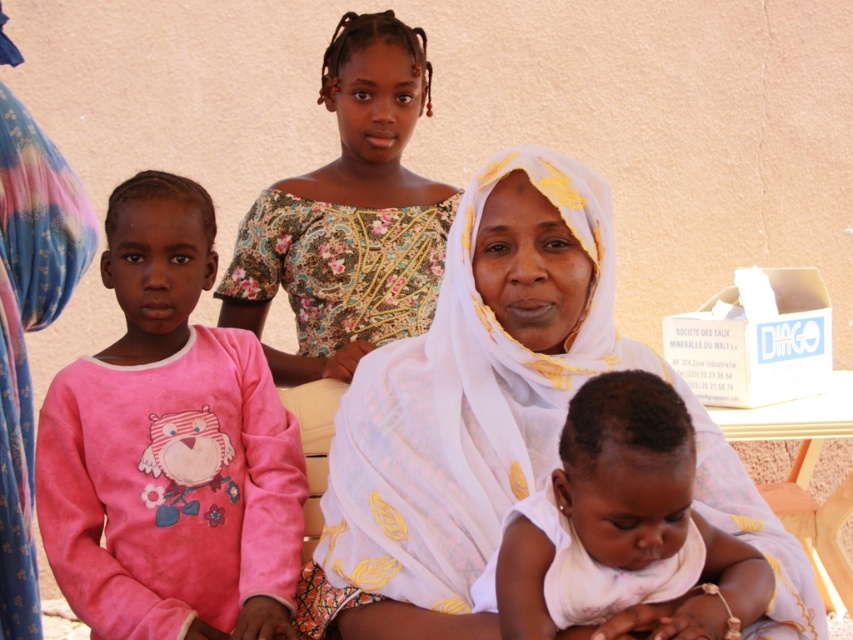
What are the coordinates of `white sheer cloth at center` in the screenshot? It's located at (471, 397).

Does white sheer cloth at center appear over white soft baby at center?

Indeed, white sheer cloth at center is positioned over white soft baby at center.

Who is more distant from viewer, [467,460] or [555,502]?

The point [467,460] is behind.

At what (x,y) coordinates should I click in order to perform the action: click on white sheer cloth at center. Please return your answer as a coordinate pair (x, y). The width and height of the screenshot is (853, 640). Looking at the image, I should click on (471, 397).

Between floral fabric dress at upper center and white soft baby at center, which one has more height?

Standing taller between the two is floral fabric dress at upper center.

Does point (286, 378) come closer to viewer compared to point (590, 600)?

No, (286, 378) is further to viewer.

Identify the location of floral fabric dress at upper center. Image resolution: width=853 pixels, height=640 pixels. (349, 216).

Between pink fleece sweater at left and floral fabric dress at upper center, which one appears on the left side from the viewer's perspective?

From the viewer's perspective, pink fleece sweater at left appears more on the left side.

Can you confirm if pink fleece sweater at left is thinner than floral fabric dress at upper center?

Correct, pink fleece sweater at left's width is less than floral fabric dress at upper center's.

Where is `pink fleece sweater at left`? This screenshot has height=640, width=853. pink fleece sweater at left is located at coordinates (169, 448).